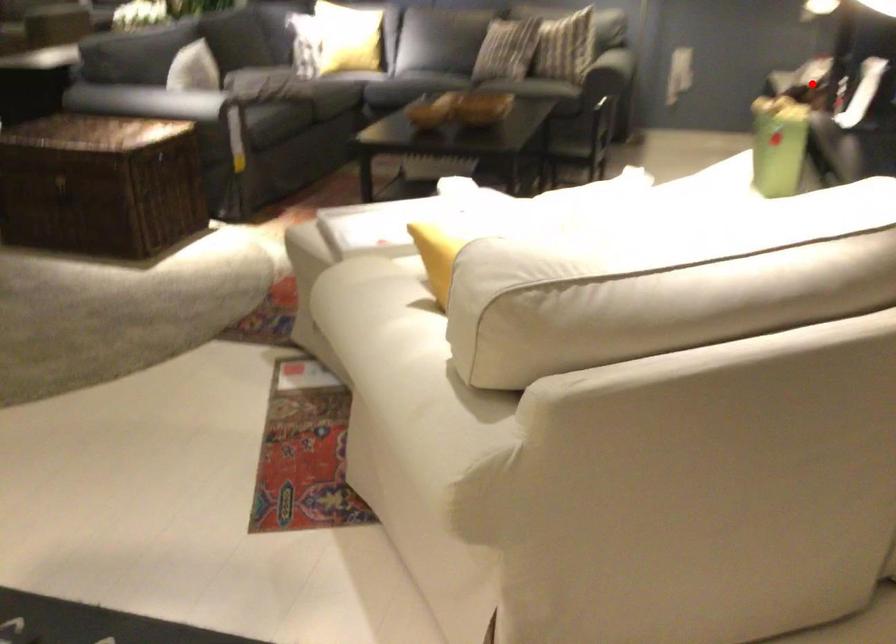
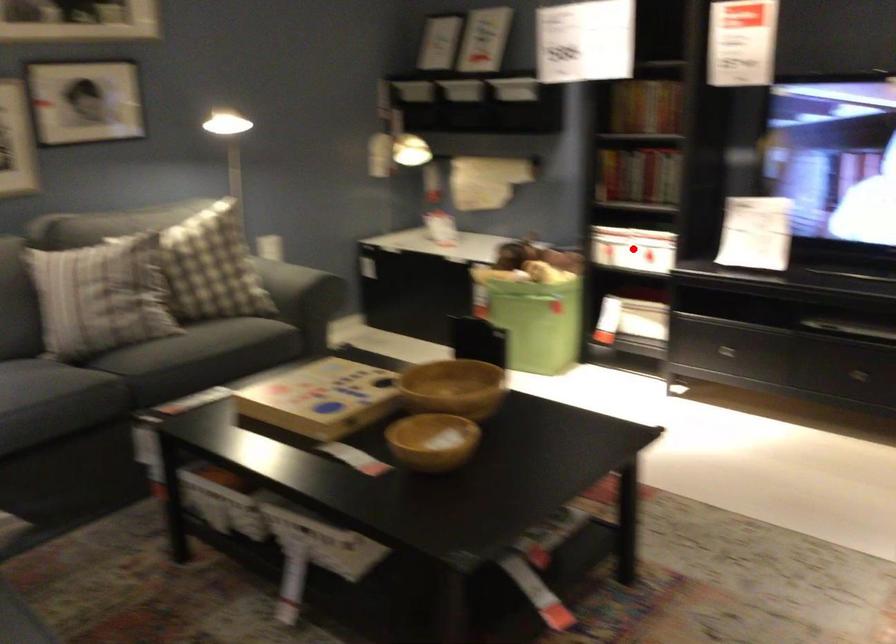
I am providing you with two images of the same scene from different viewpoints. A red point is marked on the first image and another point is marked on the second image. Does the point marked in image1 correspond to the same location as the one in image2?

Yes